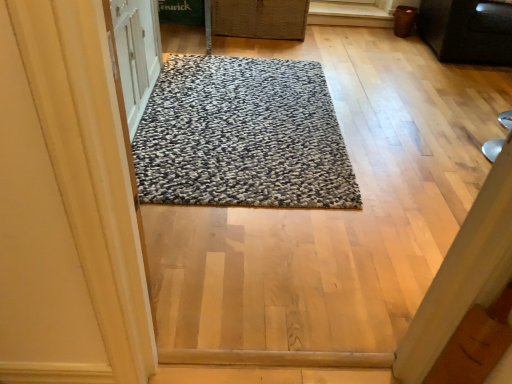
Where is `vacant space in front of woven brown basket at upper center`? Image resolution: width=512 pixels, height=384 pixels. vacant space in front of woven brown basket at upper center is located at coordinates (259, 56).